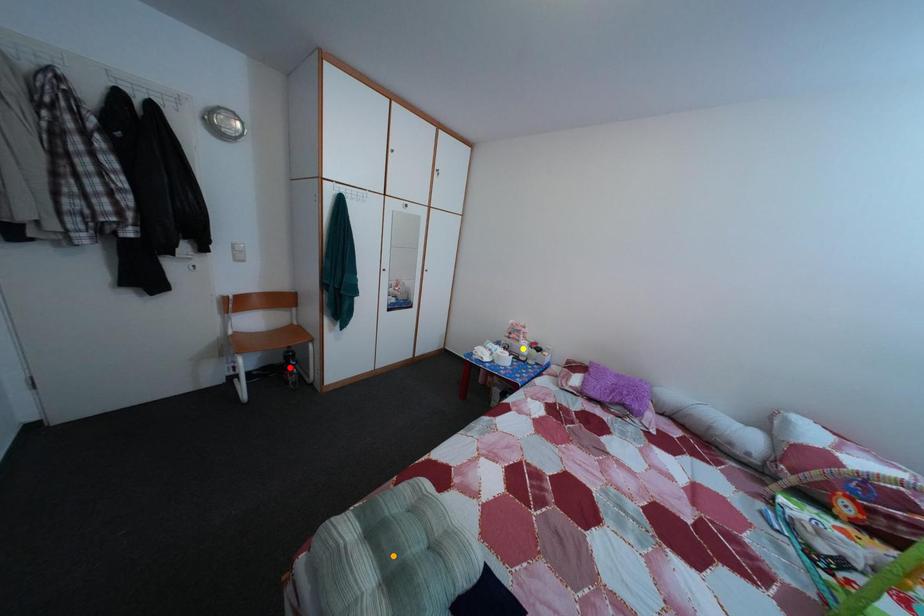
Order these from nearest to farthest:
1. yellow point
2. red point
3. orange point

orange point
red point
yellow point